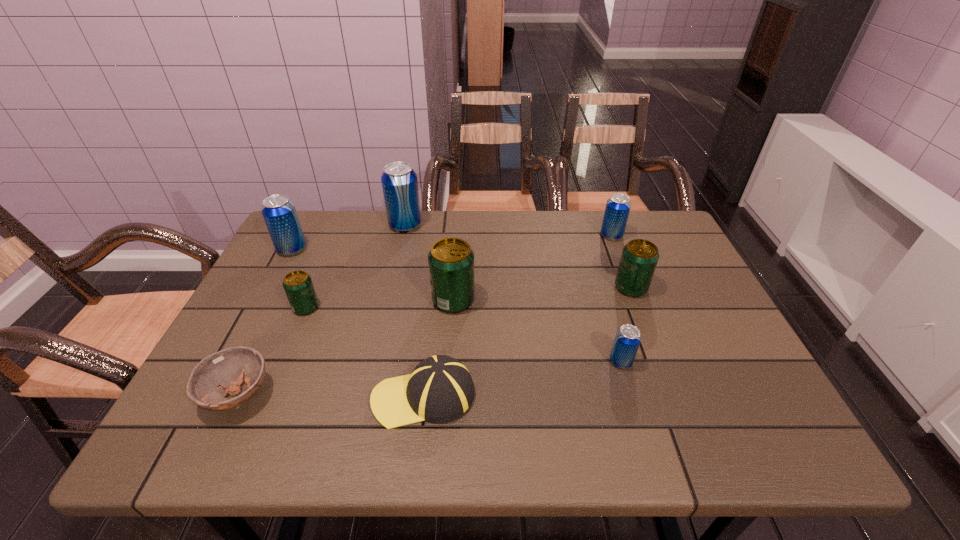
This screenshot has height=540, width=960. In order to click on object that is at the far right corner in this screenshot , I will do `click(617, 209)`.

In the image, there is a desktop. Where is `vacant space at the far edge`? vacant space at the far edge is located at coordinates (372, 246).

The image size is (960, 540). In the image, there is a desktop. Identify the location of vacant space at the near edge. (348, 428).

Where is `free location at the right edge`? This screenshot has width=960, height=540. free location at the right edge is located at coordinates (723, 361).

At what (x,y) coordinates should I click in order to perform the action: click on vacant position at the far left corner of the desktop. Please return your answer as a coordinate pair (x, y). The width and height of the screenshot is (960, 540). Looking at the image, I should click on click(301, 220).

Find the location of a particular element. Image resolution: width=960 pixels, height=540 pixels. vacant region at the near left corner of the desktop is located at coordinates (233, 438).

Locate an element on the screen. The width and height of the screenshot is (960, 540). vacant space at the far right corner is located at coordinates (668, 238).

Locate an element on the screen. This screenshot has width=960, height=540. free point between the brown bowl and the leftmost blue beer can is located at coordinates (265, 322).

You are a GUI agent. You are given a task and a screenshot of the screen. Output one action in this format:
    pyautogui.click(x=<x>, y=<y>)
    Task: Click on the vacant area that lies between the leftmost beer can and the second green beer can from left to right
    The height and width of the screenshot is (540, 960).
    Given the screenshot: What is the action you would take?
    pyautogui.click(x=372, y=275)

The height and width of the screenshot is (540, 960). I want to click on free space between the third biggest blue beer can and the black baseball cap, so click(517, 316).